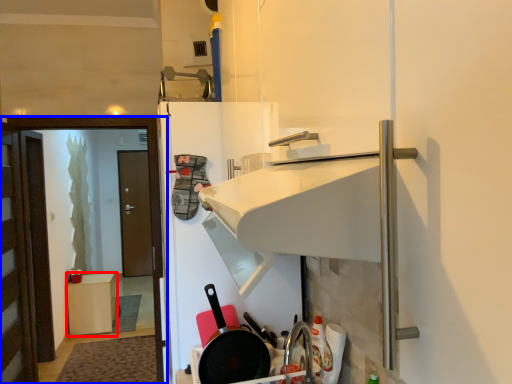
Question: Which of the following is the farthest to the observer, furniture (highlighted by a red box) or screen door (highlighted by a blue box)?

Choices:
 (A) furniture
 (B) screen door

Answer: (A)